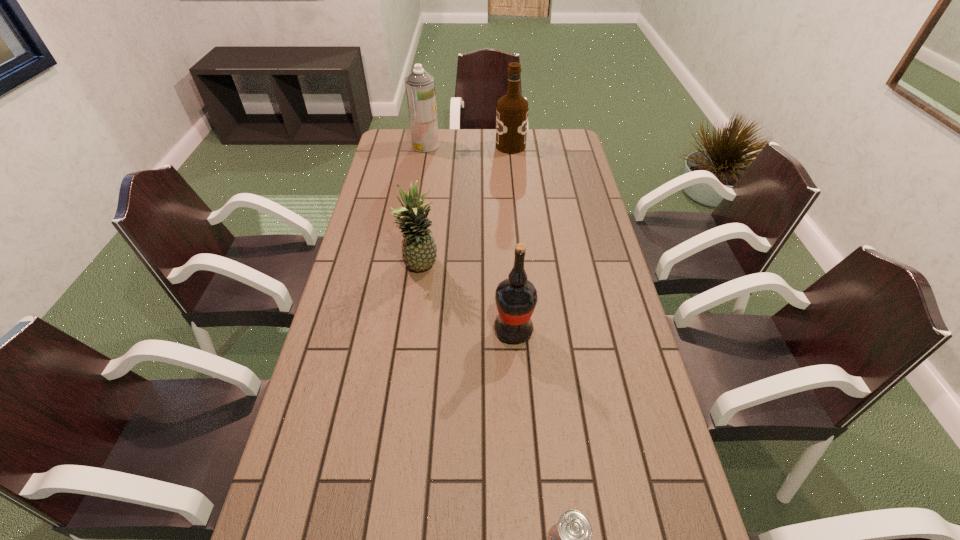
Find the location of a particular element. This screenshot has width=960, height=540. alcohol is located at coordinates (512, 109).

At what (x,y) coordinates should I click in order to perform the action: click on aerosol can. Please return your answer as a coordinate pair (x, y). The image size is (960, 540). Looking at the image, I should click on (420, 88).

The height and width of the screenshot is (540, 960). Find the location of `wine bottle`. wine bottle is located at coordinates (516, 297).

You are a GUI agent. You are given a task and a screenshot of the screen. Output one action in this format:
    pyautogui.click(x=<x>, y=<y>)
    Task: Click on the third farthest object
    
    Given the screenshot: What is the action you would take?
    pyautogui.click(x=419, y=250)

Locate an element on the screen. The width and height of the screenshot is (960, 540). vacant space located on the label of the alcohol is located at coordinates tap(472, 146).

This screenshot has width=960, height=540. What are the coordinates of `free space located on the label of the alcohol` in the screenshot? It's located at pos(429,146).

At what (x,y) coordinates should I click in order to perform the action: click on free location located on the label of the alcohol. Please return your answer as a coordinate pair (x, y). The image size is (960, 540). Looking at the image, I should click on (431, 146).

Image resolution: width=960 pixels, height=540 pixels. I want to click on free space located 0.370m on the front of the aerosol can, so click(x=416, y=206).

In order to click on vacant space situated on the left of the fourth farthest object in this screenshot , I will do `click(383, 330)`.

The height and width of the screenshot is (540, 960). I want to click on vacant space situated 0.150m on the right of the third nearest object, so click(x=489, y=268).